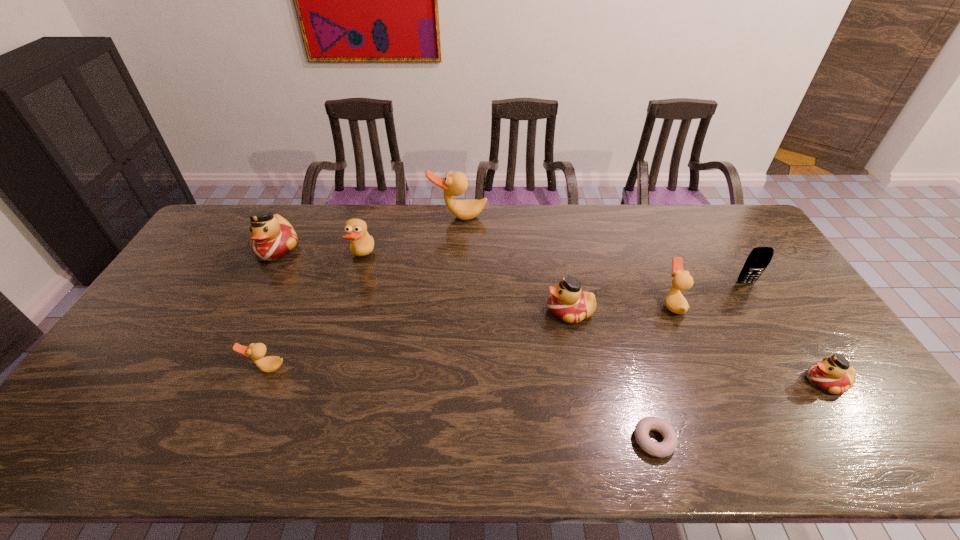
Find the location of a particular element. The height and width of the screenshot is (540, 960). vacant area located 0.210m on the beak of the smallest tan duck is located at coordinates (231, 454).

Locate an element on the screen. The image size is (960, 540). free space located 0.080m on the back of the doughnut is located at coordinates (639, 392).

Where is `object located at the near edge`? The image size is (960, 540). object located at the near edge is located at coordinates (669, 444).

Locate an element on the screen. The image size is (960, 540). cellular telephone present at the right edge is located at coordinates (759, 258).

The image size is (960, 540). In order to click on duck at the right edge in this screenshot , I will do `click(833, 374)`.

In the image, there is a desktop. At what (x,y) coordinates should I click in order to perform the action: click on free space at the far edge. Please return your answer as a coordinate pair (x, y). This screenshot has height=540, width=960. Looking at the image, I should click on pos(565,239).

Identify the location of vacant region at the near edge of the desktop. This screenshot has width=960, height=540. (220, 440).

Locate an element on the screen. The width and height of the screenshot is (960, 540). vacant space at the left edge of the desktop is located at coordinates (114, 364).

Locate an element on the screen. Image resolution: width=960 pixels, height=540 pixels. vacant space at the right edge is located at coordinates (724, 245).

This screenshot has width=960, height=540. In order to click on free space at the near right corner of the desktop in this screenshot , I will do `click(841, 436)`.